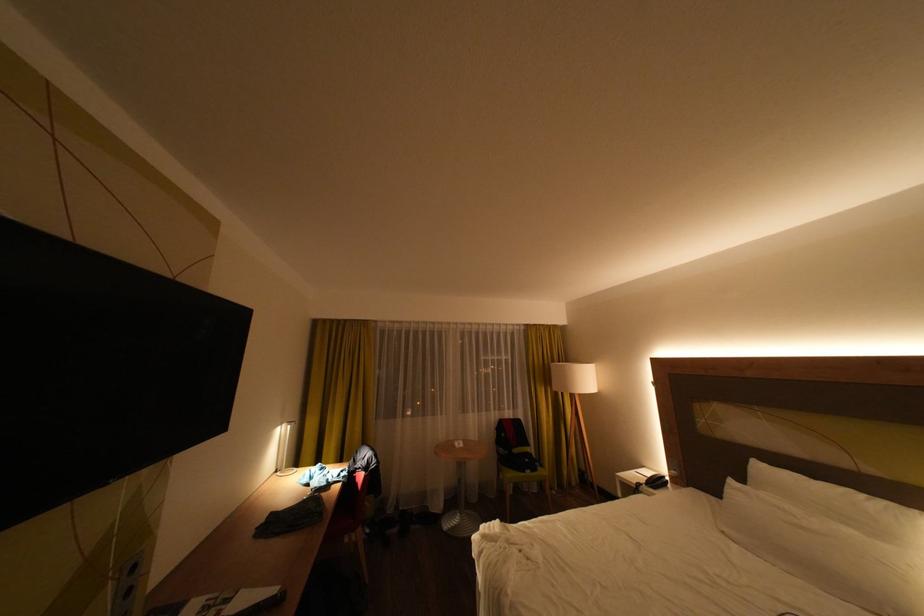
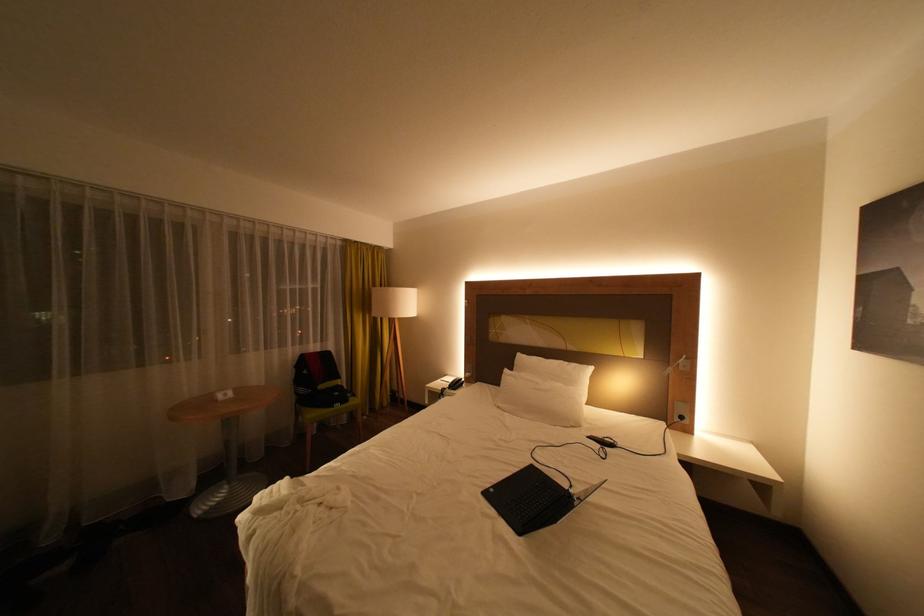
Question: The first image is from the beginning of the video and the second image is from the end. How did the camera likely rotate when shooting the video?

Choices:
 (A) Left
 (B) Right
 (C) Up
 (D) Down

Answer: (B)